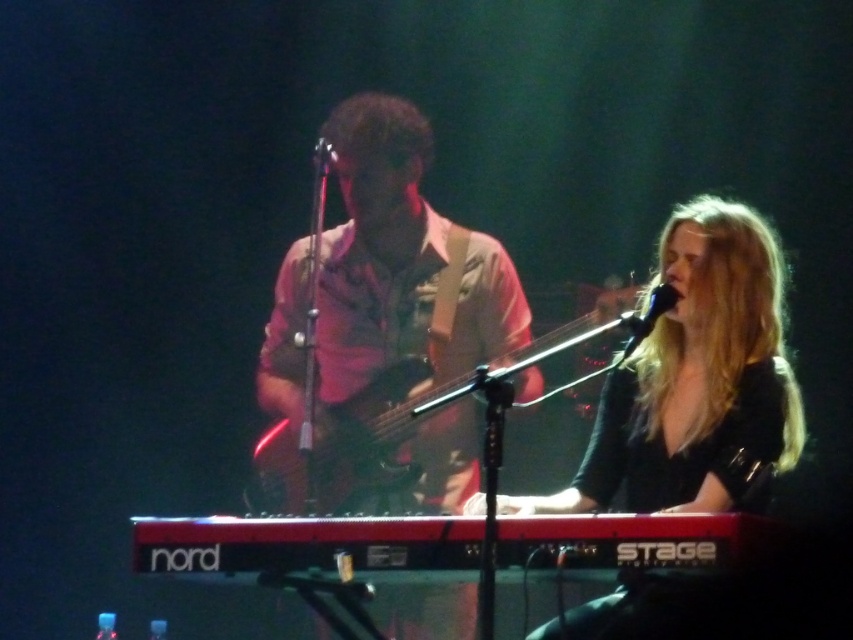
Between point (689, 272) and point (316, 147), which one is positioned behind?

The point (316, 147) is behind.

Is black matte keyboard at center smaller than metallic silver microphone at center?

Incorrect, black matte keyboard at center is not smaller in size than metallic silver microphone at center.

Which is in front, point (618, 426) or point (328, 145)?

Positioned in front is point (618, 426).

At what (x,y) coordinates should I click in order to perform the action: click on black matte keyboard at center. Please return your answer as a coordinate pair (x, y). This screenshot has width=853, height=640. Looking at the image, I should click on (695, 381).

Who is shorter, black matte keyboard at center or black matte microphone at upper center?

black matte microphone at upper center is shorter.

Between point (718, 260) and point (631, 337), which one is positioned in front?

Point (631, 337) is in front.

The height and width of the screenshot is (640, 853). Identify the location of black matte keyboard at center. (695, 381).

Between matte pink shirt at center and wooden electric bass at center, which one appears on the right side from the viewer's perspective?

wooden electric bass at center is more to the right.

Can you confirm if matte pink shirt at center is wider than wooden electric bass at center?

In fact, matte pink shirt at center might be narrower than wooden electric bass at center.

Is point (401, 182) farther from camera compared to point (561, 337)?

Yes, it is behind point (561, 337).

Image resolution: width=853 pixels, height=640 pixels. Identify the location of matte pink shirt at center. (403, 260).